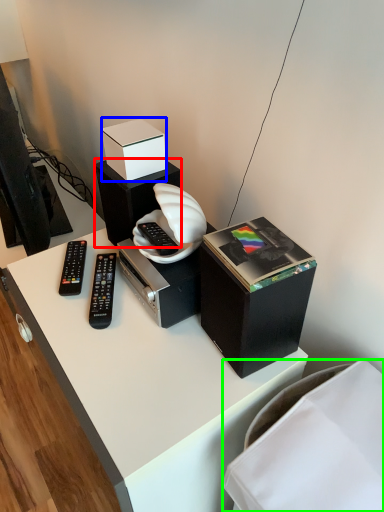
Question: Which object is the farthest from speaker (highlighted by a red box)? Choose among these: box (highlighted by a blue box) or furniture (highlighted by a green box).

Choices:
 (A) box
 (B) furniture

Answer: (B)